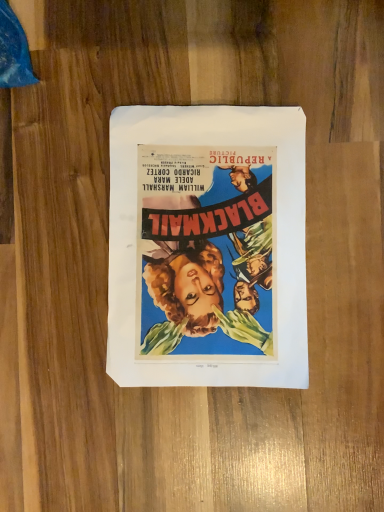
I want to click on blank space situated above matte paper poster at center (from a real-world perspective), so click(211, 241).